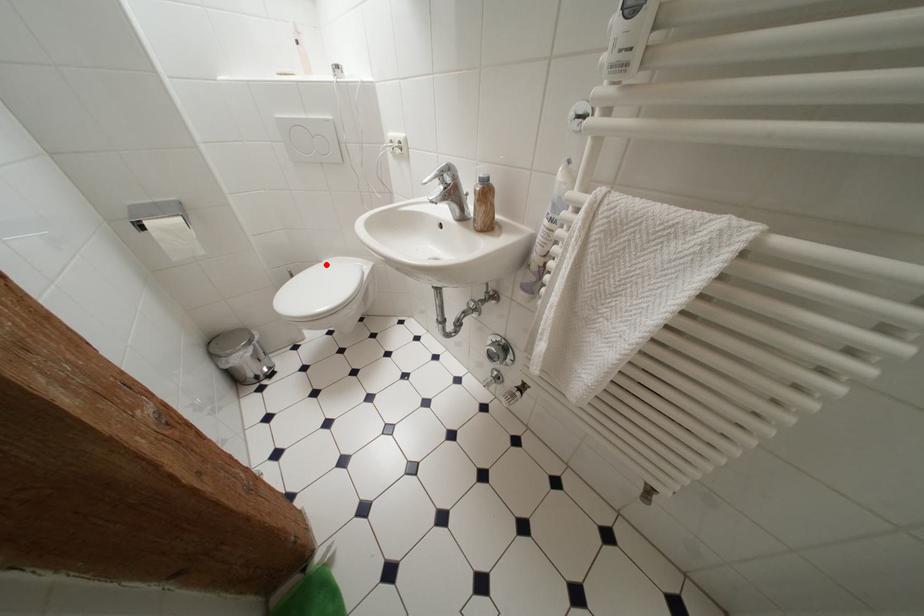
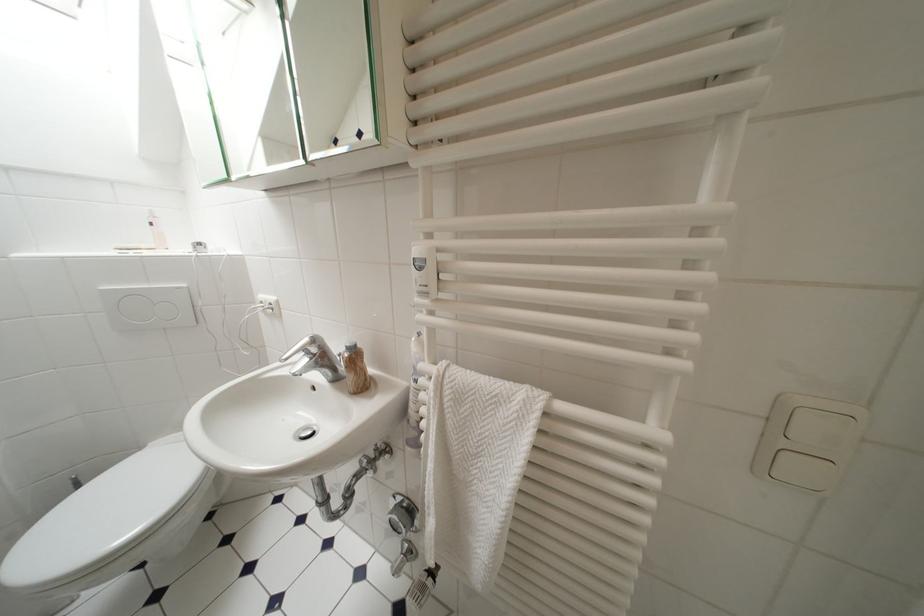
Where in the second image is the point corresponding to the highlighted location from the first image?

(148, 451)